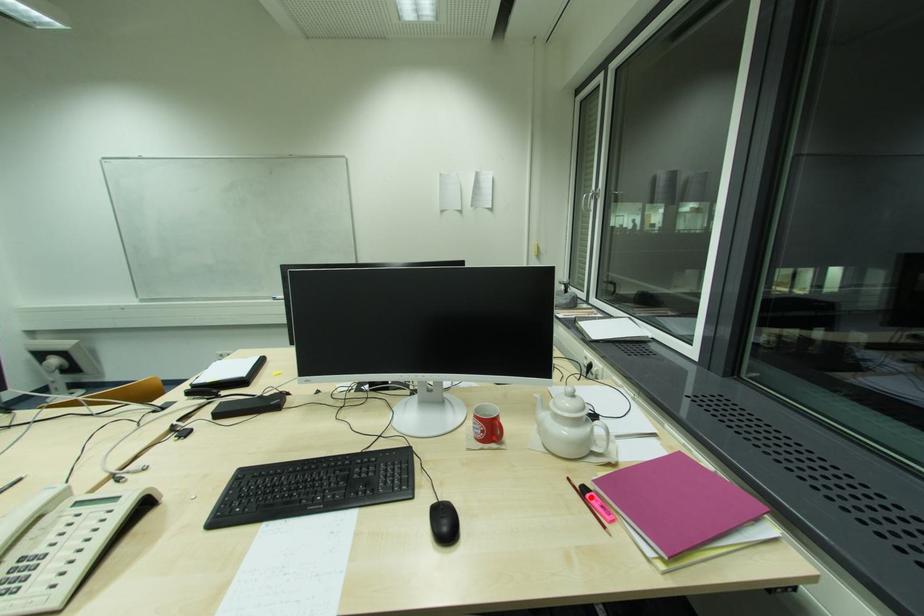
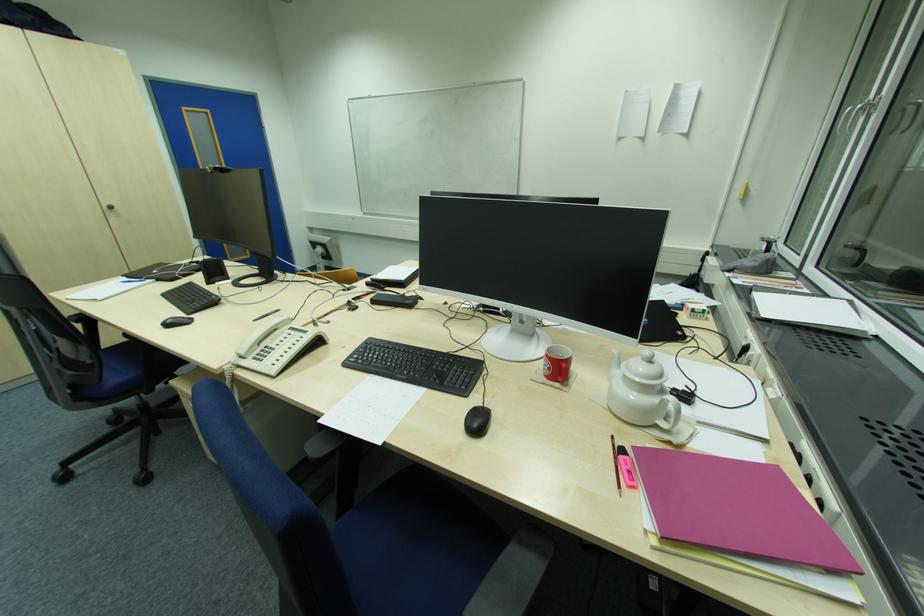
The point at the highlighted location is marked in the first image. Where is the corresponding point in the second image?

(623, 459)